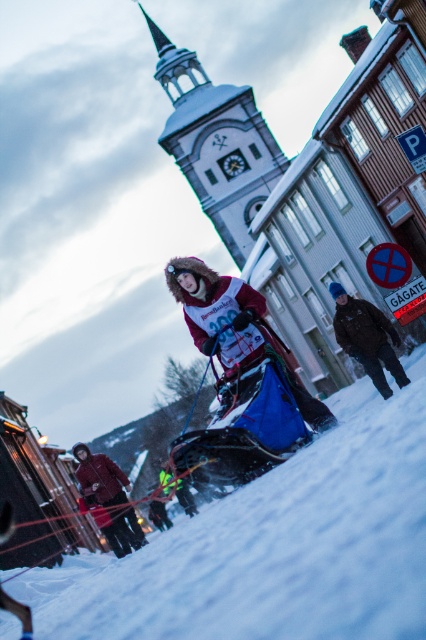
Is point (265, 528) closer to camera compared to point (189, 269)?

Yes, it is.

Can you confirm if white powdery snow at center is positioned to the right of matte red ski suit at center?

In fact, white powdery snow at center is to the left of matte red ski suit at center.

Between point (224, 584) and point (279, 337), which one is positioned in front?

Point (224, 584) is more forward.

Where is `white powdery snow at center`? This screenshot has width=426, height=640. white powdery snow at center is located at coordinates (273, 547).

Between white powdery snow at center and dark brown leather jacket at center, which one is positioned higher?

dark brown leather jacket at center is higher up.

Does point (164, 589) lie behind point (385, 353)?

No, (164, 589) is closer to viewer.

Locate an element on the screen. white powdery snow at center is located at coordinates (273, 547).

Looking at this image, can you confirm if dark brown leather jacket at center is positioned to the right of matte red jacket at lower left?

Correct, you'll find dark brown leather jacket at center to the right of matte red jacket at lower left.

Consider the image. Who is shorter, dark brown leather jacket at center or matte red jacket at lower left?

With less height is matte red jacket at lower left.

Locate an element on the screen. The image size is (426, 640). dark brown leather jacket at center is located at coordinates (367, 337).